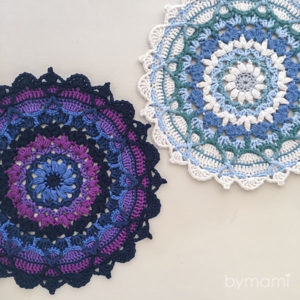
Find the location of a particular element. Image resolution: width=300 pixels, height=300 pixels. white surface is located at coordinates (218, 240).